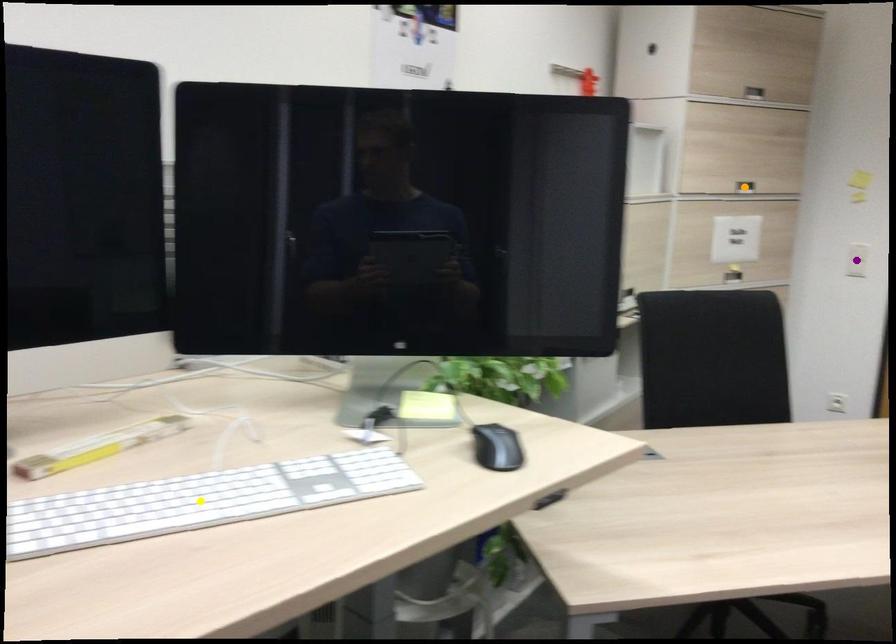
Order these from nearest to farthest:
A) purple point
B) yellow point
C) orange point

yellow point < orange point < purple point